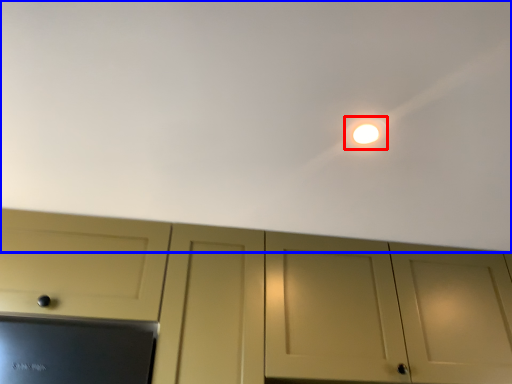
Question: Which point is further to the camera, light (highlighted by a red box) or backdrop (highlighted by a blue box)?

Choices:
 (A) light
 (B) backdrop

Answer: (A)